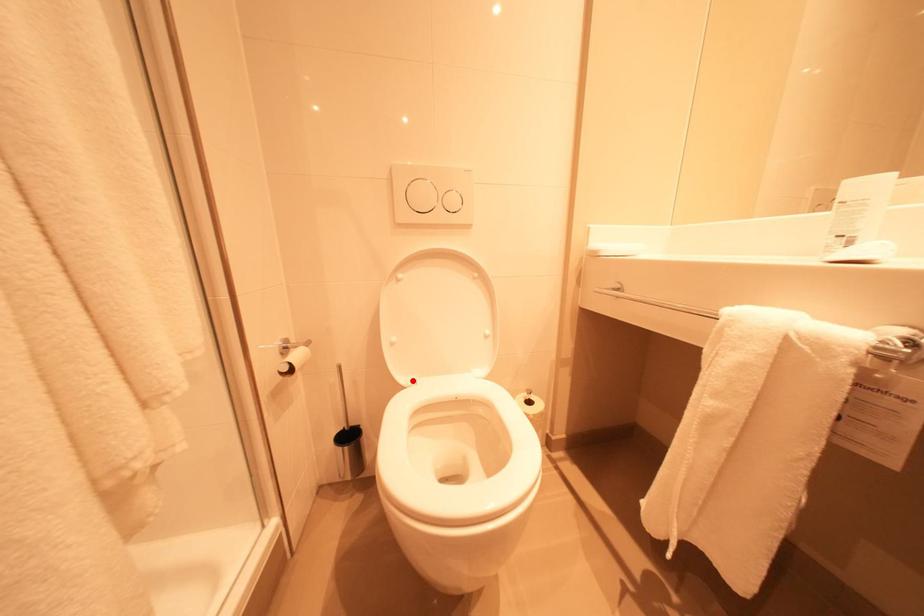
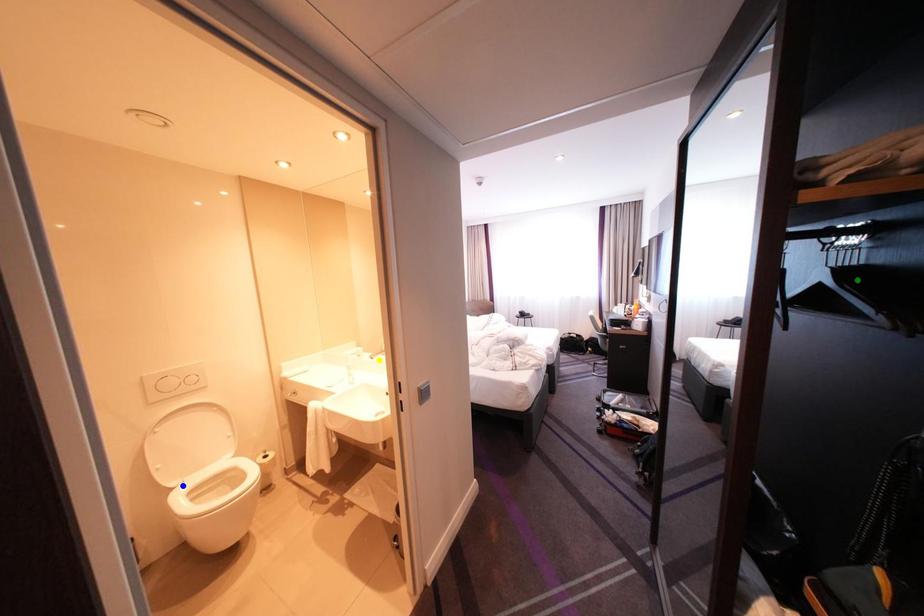
Question: I am providing you with two images of the same scene from different viewpoints. A red point is marked on the first image. You are given multiple points on the second image. Which mark in image 2 goes with the point in image 1?

Choices:
 (A) blue point
 (B) yellow point
 (C) green point

Answer: (A)